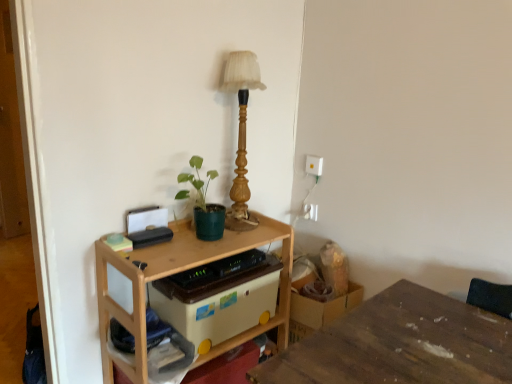
Identify the location of spots to the right of green matte plant at center. (242, 241).